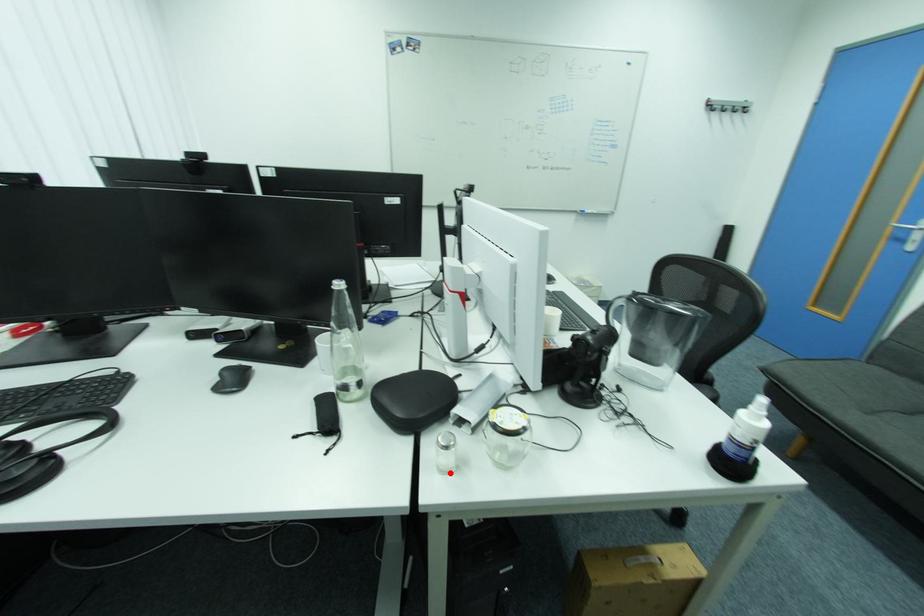
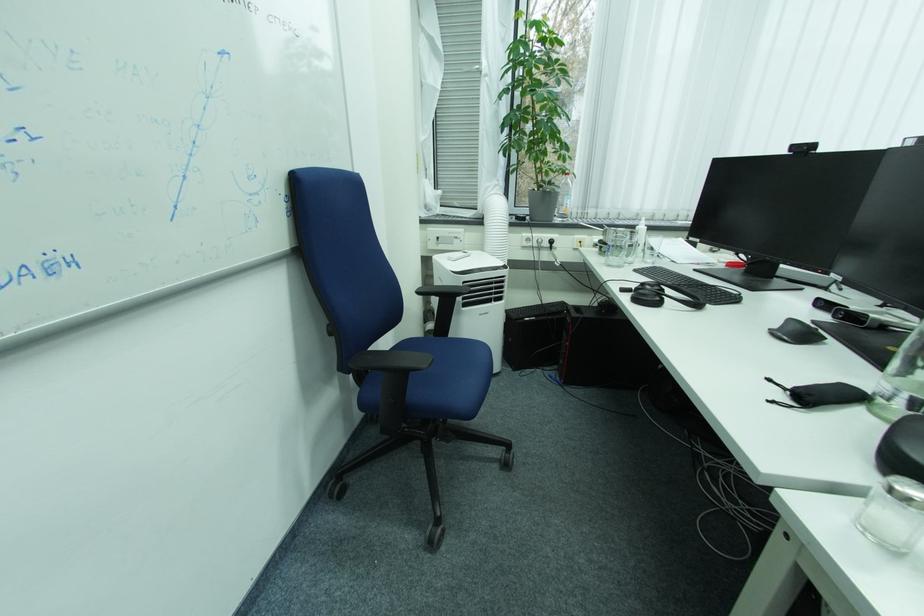
Locate, in the second image, the point that corresponds to the highlighted location in the first image.

(870, 529)